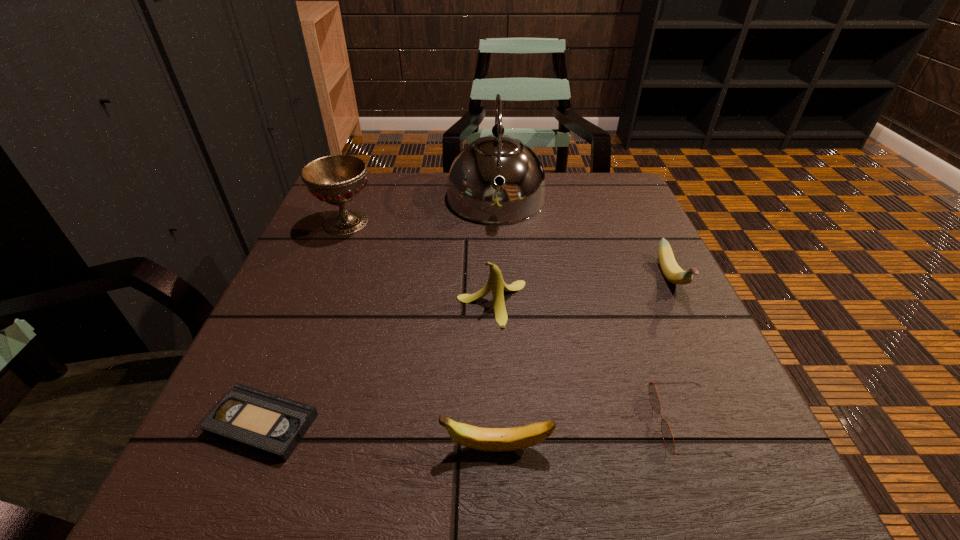
At what (x,y) coordinates should I click in order to perform the action: click on object at the near right corner. Please return your answer as a coordinate pair (x, y). This screenshot has width=960, height=540. Looking at the image, I should click on (667, 435).

In order to click on vacant space at the far edge of the desktop in this screenshot , I will do `click(502, 179)`.

At what (x,y) coordinates should I click in order to perform the action: click on free spot at the near edge of the desktop. Please return your answer as a coordinate pair (x, y). This screenshot has width=960, height=540. Looking at the image, I should click on (537, 461).

Identify the location of free space at the left edge of the desktop. (312, 400).

Identify the location of vacant space at the right edge. This screenshot has width=960, height=540. (712, 390).

This screenshot has height=540, width=960. Find the location of `vacant region at the far left corner of the desktop`. vacant region at the far left corner of the desktop is located at coordinates (319, 220).

In the image, there is a desktop. Identify the location of vacant space at the far right corner. The width and height of the screenshot is (960, 540). (640, 219).

I want to click on vacant area between the rightmost banana and the kettle, so click(x=584, y=239).

The height and width of the screenshot is (540, 960). I want to click on empty space that is in between the sixth tallest object and the shortest object, so click(x=474, y=423).

Locate an element on the screen. This screenshot has width=960, height=540. unoccupied area between the sixth shortest object and the shortest object is located at coordinates (304, 323).